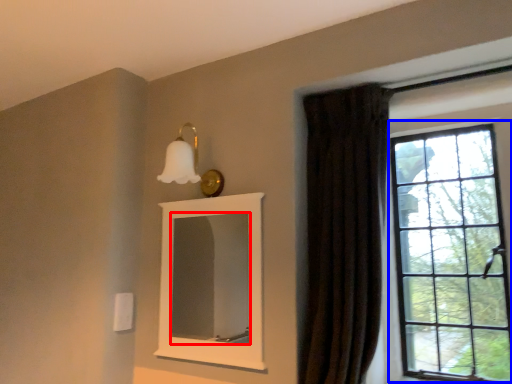
Question: Which of the following is the farthest to the observer, mirror (highlighted by a red box) or window (highlighted by a blue box)?

Choices:
 (A) mirror
 (B) window

Answer: (A)